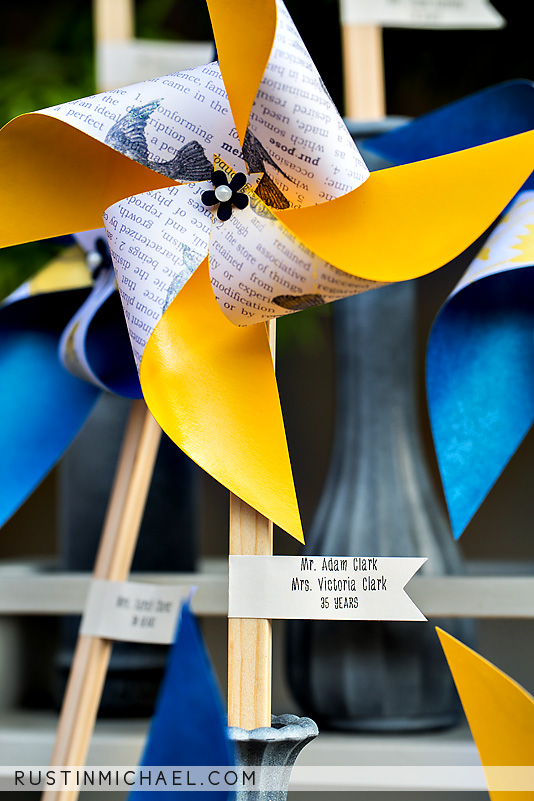
At what (x,y) coordinates should I click in order to perform the action: click on vase necks. Please return your answer as a coordinate pair (x, y). The height and width of the screenshot is (801, 534). Looking at the image, I should click on (356, 129), (284, 739).